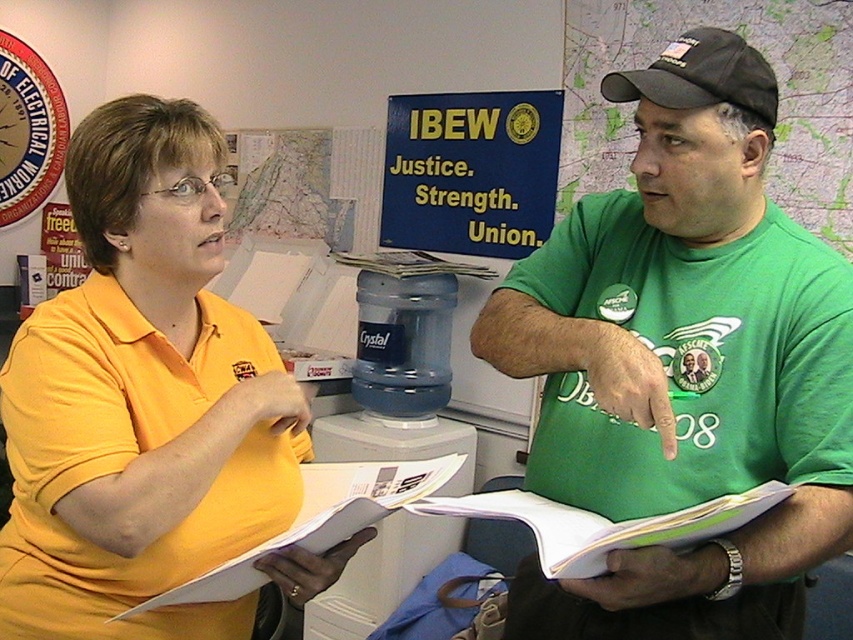
You are standing at the point labeled point (698, 67). You want to walk straight ahead. Will you eventually reach point (194, 636)?

Point (194, 636) is behind point (698, 67), so if you walk straight ahead from point (698, 67), you will not reach point (194, 636) because it is in the opposite direction.

You are a photographer standing at the camera position. You want to take a closeup shot of the green cotton shirt at center. What is the minimum distance you need to move forward to ensure the shirt fills the frame?

The green cotton shirt at center is 36.65 inches from the camera. To take a closeup shot, you need to move forward until the shirt is within the frame, so the minimum distance to move forward would be 36.65 inches minus the desired focal length. However, without knowing the exact focal length required, the closest you can get is moving to 0 inches away, but practically, you should move forward to within a reasonable distance where the shirt fills the frame without distortion.

You are an office worker who needs to hang a new poster that is 1.2 meters tall. You have two options for placement locations near the green cotton shirt at center and the black fabric cap at upper right. Based on their heights, which location would allow the poster to be fully visible without being blocked?

The green cotton shirt at center is much taller than the black fabric cap at upper right. Therefore, placing the poster near the black fabric cap at upper right would ensure it is fully visible since the poster is shorter than the green cotton shirt at center but the cap is shorter, so the poster won